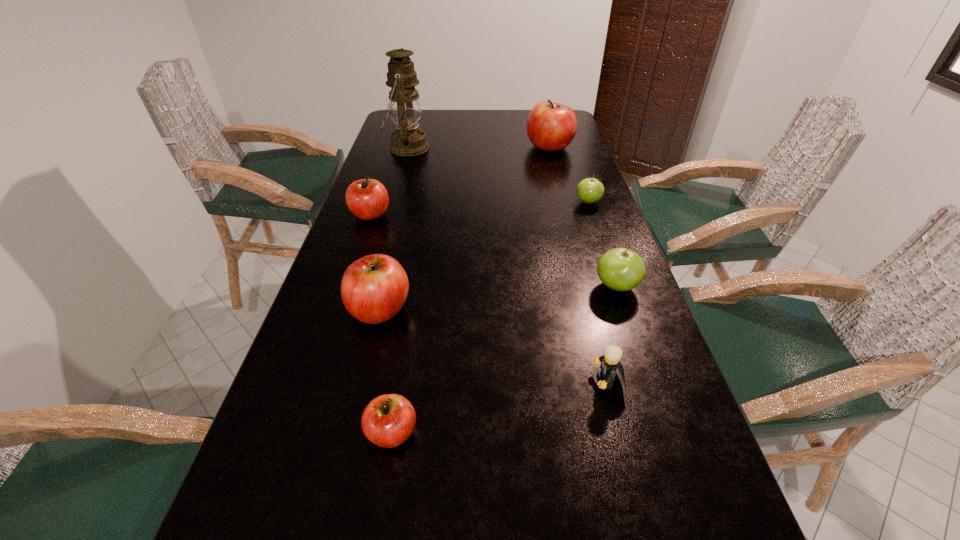
Where is `blank space located 0.270m on the front of the farther green apple`? blank space located 0.270m on the front of the farther green apple is located at coordinates (611, 268).

Identify the location of blank space located 0.310m on the back of the nearest object. The height and width of the screenshot is (540, 960). (415, 294).

Find the location of a particular element. The width and height of the screenshot is (960, 540). oil lamp located in the left edge section of the desktop is located at coordinates (404, 102).

Locate an element on the screen. Lego that is at the right edge is located at coordinates (610, 361).

Where is `vacant space at the far edge of the desktop`? vacant space at the far edge of the desktop is located at coordinates (438, 125).

At what (x,y) coordinates should I click in order to perform the action: click on free location at the left edge. Please return your answer as a coordinate pair (x, y). Image resolution: width=960 pixels, height=540 pixels. Looking at the image, I should click on (380, 220).

Where is `free space at the right edge`? free space at the right edge is located at coordinates (558, 209).

Locate an element on the screen. empty space that is in between the nearer green apple and the seventh shortest object is located at coordinates (583, 217).

Locate an element on the screen. Image resolution: width=960 pixels, height=540 pixels. empty space between the nearer green apple and the rightmost red apple is located at coordinates (583, 217).

This screenshot has width=960, height=540. In order to click on free space between the rightmost red apple and the Lego in this screenshot , I will do `click(579, 264)`.